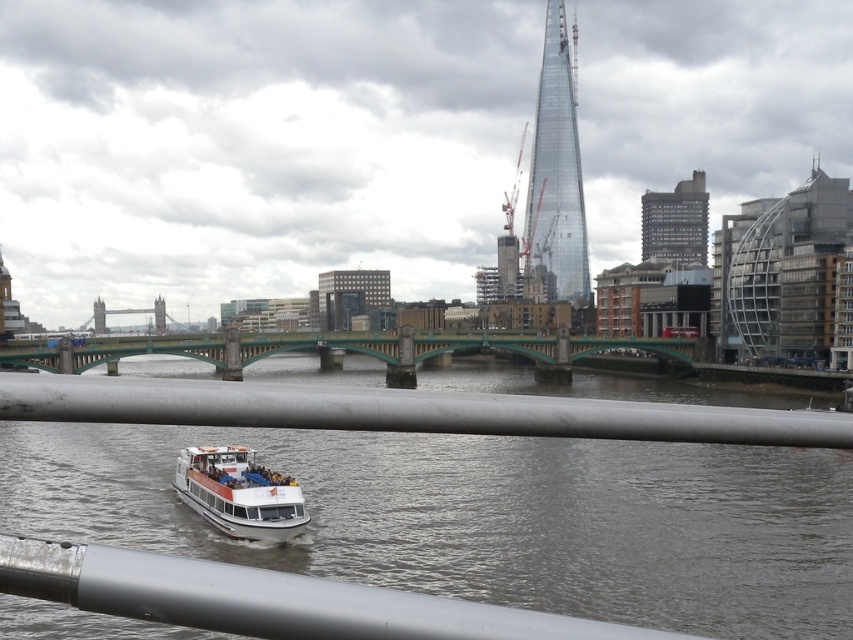
You are a tourist standing on the riverbank looking towards the green bridge. You notice two rails in the scene. The first is the silver metallic railing at center, and the second is the metallic gray rail at lower center. Which of these two rails appears larger in size?

The silver metallic railing at center appears larger in size than the metallic gray rail at lower center.

You are standing on the deck of the white boat with orange accents and want to look at both the silver metallic railing at center and the metallic gray rail at lower center. Which one is closer to your right side?

The silver metallic railing at center is positioned on the right side of metallic gray rail at lower center, so it is closer to your right side.

You are a tourist standing on the green bridge and want to take a photo of both the transparent glass tower at upper center and the white matte boat at lower center in the same frame. Given that your camera has a maximum zoom range of 100 meters, will you be able to capture both objects in one photo?

The transparent glass tower at upper center and the white matte boat at lower center are 253.35 meters apart. Since your camera can only zoom up to 100 meters, the distance between them exceeds the camera range. Therefore, you won not be able to capture both in one photo.